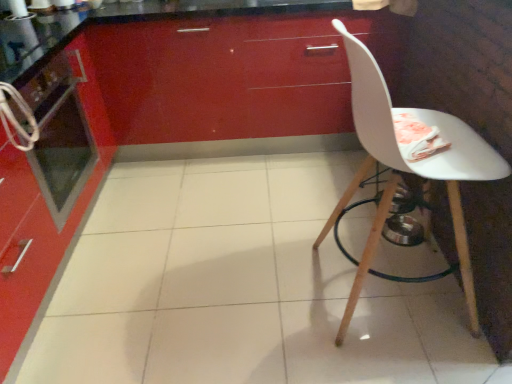
Locate an element on the screen. The image size is (512, 384). vacant space behind white matte chair at right is located at coordinates (326, 221).